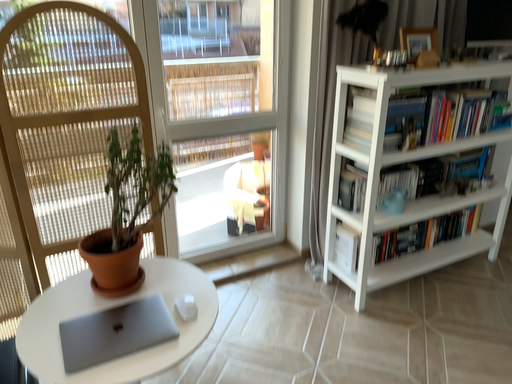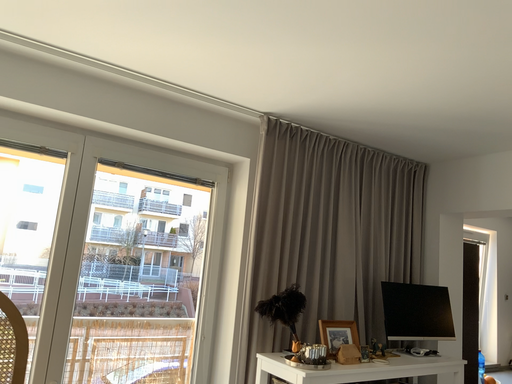
Question: How did the camera likely rotate when shooting the video?

Choices:
 (A) rotated left
 (B) rotated right

Answer: (B)